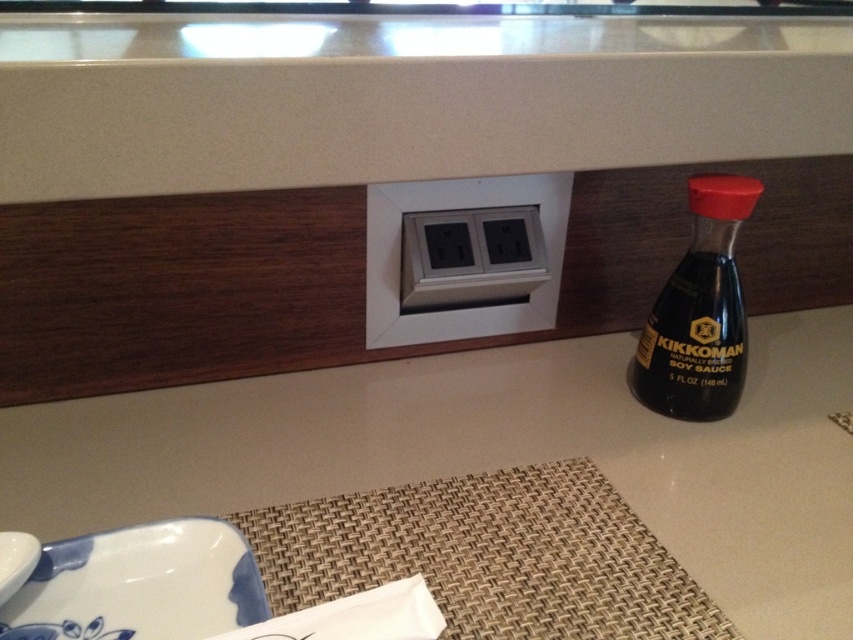
Question: Estimate the real-world distances between objects in this image. Which object is farther from the dark wood drawer at upper left?

Choices:
 (A) woven beige placemat at lower center
 (B) blue glossy plate at lower left
 (C) white glossy plate at lower left

Answer: (C)

Question: Based on their relative distances, which object is farther from the woven beige placemat at lower center?

Choices:
 (A) white plastic electrical outlet at center
 (B) white matte counter top at center
 (C) black glass bottle at right

Answer: (A)

Question: Is woven beige placemat at lower center thinner than white glossy plate at lower left?

Choices:
 (A) no
 (B) yes

Answer: (A)

Question: Which point is farther to the camera?

Choices:
 (A) (45, 305)
 (B) (729, 241)
 (C) (183, 625)
 (D) (192, 444)

Answer: (B)

Question: Does white matte counter top at center appear on the left side of dark wood drawer at upper left?

Choices:
 (A) no
 (B) yes

Answer: (A)

Question: Does blue glossy plate at lower left have a larger size compared to black glass bottle at right?

Choices:
 (A) yes
 (B) no

Answer: (B)